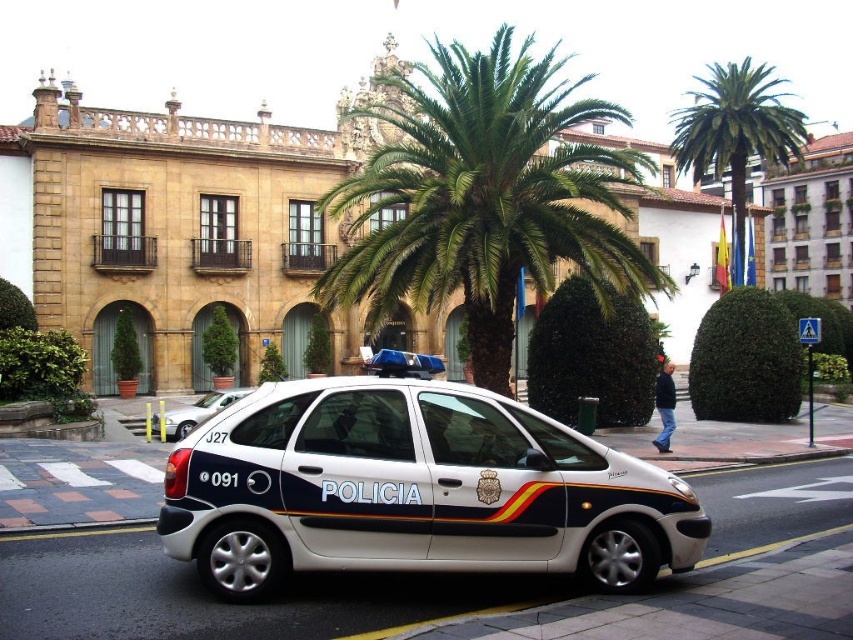
Based on the photo, you are standing at the entrance of a European city square and see the green leafy palm tree at center. If you walk directly towards the palm tree, which direction should you face to ensure you are moving straight towards it?

Since the green leafy palm tree at center is located at point (485, 198) in the image, you should face the center of the image to walk directly towards it.

You are standing in a European city square and see a green leafy palm tree at center and a white matte car at center. Which object is positioned more to the east?

The green leafy palm tree at center is positioned more to the east because it is to the right of the white matte car at center, and in this scene, right corresponds to the eastern direction.

You are a pedestrian standing at the edge of the road and see the white glossy police van at center and the matte white car at center. Which vehicle is closer to you?

The white glossy police van at center is closer to you because it is in front of the matte white car at center.